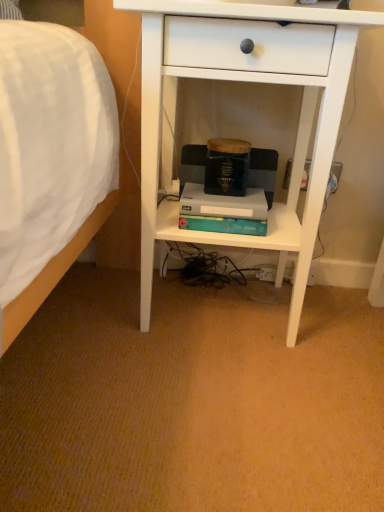
Question: Can you confirm if teal matte paperback book at center is shorter than white matte desk at center?

Choices:
 (A) no
 (B) yes

Answer: (B)

Question: Is teal matte paperback book at center further to camera compared to white matte desk at center?

Choices:
 (A) yes
 (B) no

Answer: (A)

Question: Is teal matte paperback book at center positioned in front of white matte desk at center?

Choices:
 (A) no
 (B) yes

Answer: (A)

Question: Is teal matte paperback book at center wider than white matte desk at center?

Choices:
 (A) no
 (B) yes

Answer: (A)

Question: Is white matte desk at center a part of teal matte paperback book at center?

Choices:
 (A) yes
 (B) no

Answer: (B)

Question: Is teal matte paperback book at center directly adjacent to white matte desk at center?

Choices:
 (A) no
 (B) yes

Answer: (A)

Question: Can you confirm if white matte desk at center is smaller than teal matte paperback book at center?

Choices:
 (A) yes
 (B) no

Answer: (B)

Question: Is white matte desk at center turned away from teal matte paperback book at center?

Choices:
 (A) yes
 (B) no

Answer: (A)

Question: Considering the relative sizes of white matte desk at center and teal matte paperback book at center in the image provided, is white matte desk at center shorter than teal matte paperback book at center?

Choices:
 (A) yes
 (B) no

Answer: (B)

Question: Is white matte desk at center at the right side of teal matte paperback book at center?

Choices:
 (A) yes
 (B) no

Answer: (A)

Question: Does white matte desk at center have a lesser width compared to teal matte paperback book at center?

Choices:
 (A) yes
 (B) no

Answer: (B)

Question: From a real-world perspective, is white matte desk at center on teal matte paperback book at center?

Choices:
 (A) yes
 (B) no

Answer: (A)

Question: From a real-world perspective, is teal matte paperback book at center physically located above or below white matte desk at center?

Choices:
 (A) above
 (B) below

Answer: (B)